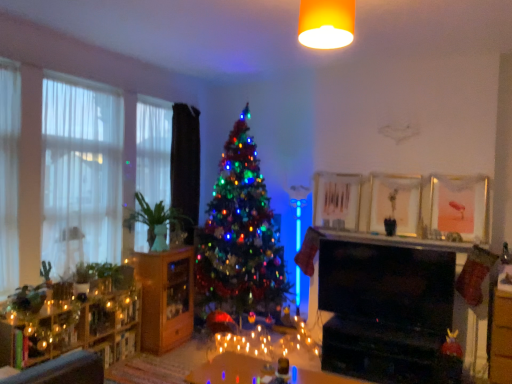
Question: In terms of width, does green matte vase at left, which appears as the first plant when viewed from the top, look wider or thinner when compared to white sheer curtain at left, arranged as the second window when viewed from the left?

Choices:
 (A) wide
 (B) thin

Answer: (A)

Question: Considering the positions of green matte vase at left, which appears as the first plant when viewed from the top, and white sheer curtain at left, arranged as the 1th window when viewed from the right, in the image, is green matte vase at left, which appears as the first plant when viewed from the top, taller or shorter than white sheer curtain at left, arranged as the 1th window when viewed from the right,?

Choices:
 (A) short
 (B) tall

Answer: (A)

Question: Which of these objects is positioned closest to the pink matte picture frame at upper right, placed as the first picture frame when sorted from right to left?

Choices:
 (A) green matte vase at left, which appears as the 2th plant when ordered from the bottom
 (B) yellow matte light fixture at upper center
 (C) translucent glass table at center
 (D) shiny multicolored tree at center
 (E) white sheer curtain at left, arranged as the second window when viewed from the left

Answer: (C)

Question: Which is nearer to the black fabric curtain at left?

Choices:
 (A) green matte plant at left, which appears as the 1th plant when ordered from the bottom
 (B) metallic gold picture frame at upper center, placed as the 1th picture frame when sorted from left to right
 (C) green matte vase at left, which appears as the 2th plant when ordered from the bottom
 (D) wooden cabinet at left, arranged as the 1th dresser when viewed from the back
 (E) wooden shelves at left, which ranks as the 1th dresser in front-to-back order

Answer: (C)